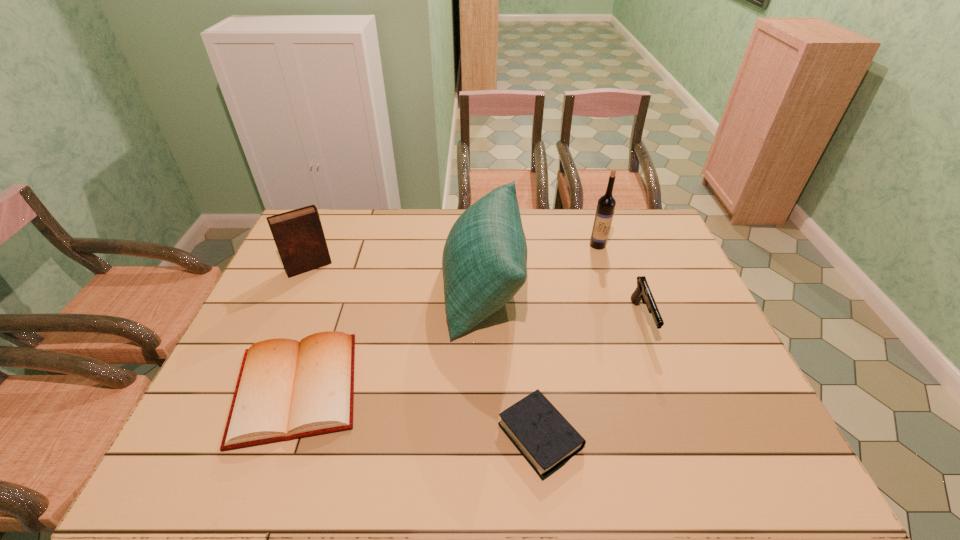
The image size is (960, 540). Identify the location of the fifth object from left to right. (606, 204).

Find the location of a particular element. This screenshot has height=540, width=960. cushion is located at coordinates (484, 262).

This screenshot has height=540, width=960. Identify the location of the fourth shortest object. (x=298, y=234).

Identify the location of the farthest Bible. The width and height of the screenshot is (960, 540). (298, 234).

Where is `the third shortest object`? This screenshot has width=960, height=540. the third shortest object is located at coordinates (642, 292).

This screenshot has width=960, height=540. Find the location of `the rightmost object`. the rightmost object is located at coordinates (642, 292).

Find the location of `the rightmost Bible`. the rightmost Bible is located at coordinates (539, 431).

Find the location of a particular element. The height and width of the screenshot is (540, 960). vacant region located 0.090m on the label of the fifth object from left to right is located at coordinates (605, 267).

The height and width of the screenshot is (540, 960). I want to click on vacant space located on the front-facing side of the cushion, so click(334, 287).

Where is `free space located 0.250m on the front-facing side of the cushion`? The image size is (960, 540). free space located 0.250m on the front-facing side of the cushion is located at coordinates coord(366,287).